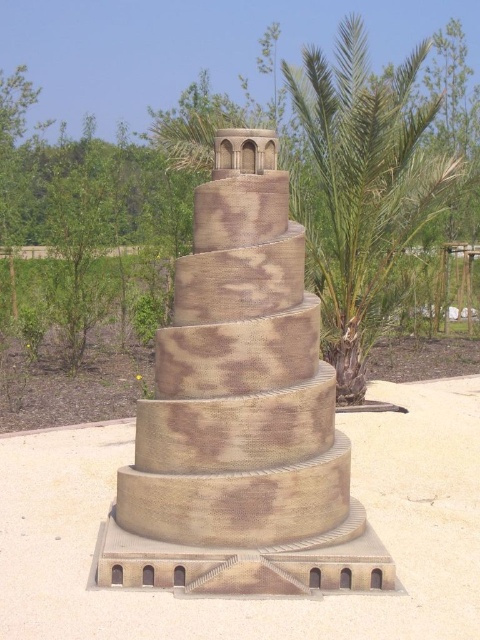
Question: Among these points, which one is farthest from the camera?

Choices:
 (A) (263, 266)
 (B) (423, 205)
 (C) (23, 508)

Answer: (B)

Question: Is sandstone tower at center positioned before beige textured sand at center?

Choices:
 (A) yes
 (B) no

Answer: (A)

Question: Does beige textured sand at center appear on the left side of green leafy palm tree at upper right?

Choices:
 (A) yes
 (B) no

Answer: (A)

Question: Is beige textured sand at center below green leafy palm tree at upper right?

Choices:
 (A) yes
 (B) no

Answer: (A)

Question: Which object appears farthest from the camera in this image?

Choices:
 (A) green leafy palm tree at upper right
 (B) sandstone tower at center
 (C) beige textured sand at center

Answer: (A)

Question: Based on their relative distances, which object is nearer to the beige textured sand at center?

Choices:
 (A) green leafy palm tree at upper right
 (B) sandstone tower at center

Answer: (B)